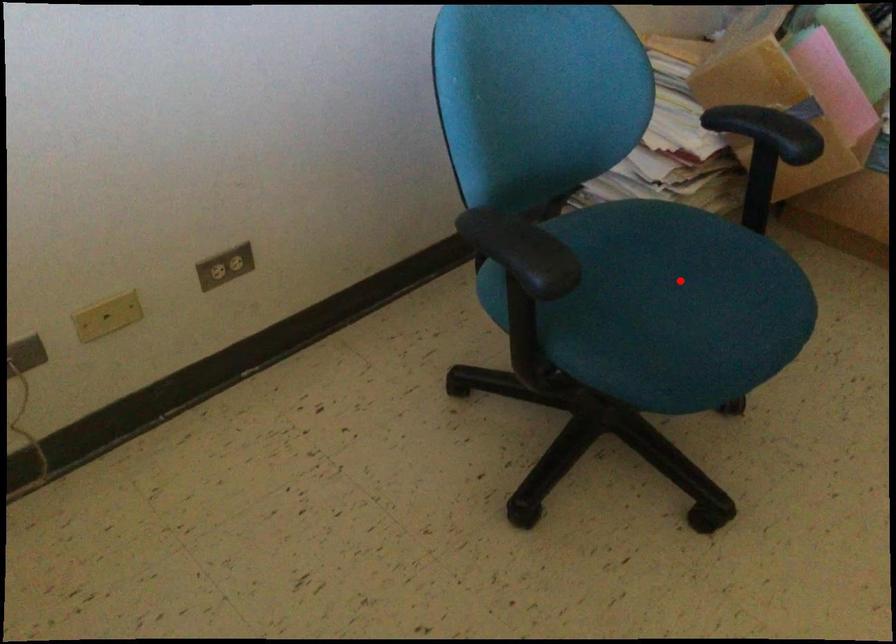
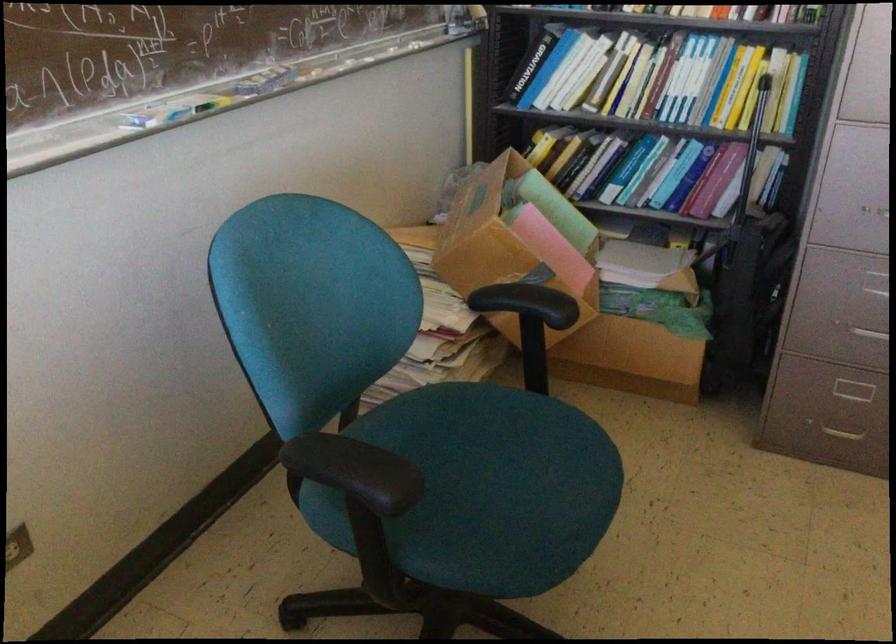
In the second image, find the point that corresponds to the highlighted location in the first image.

(498, 458)